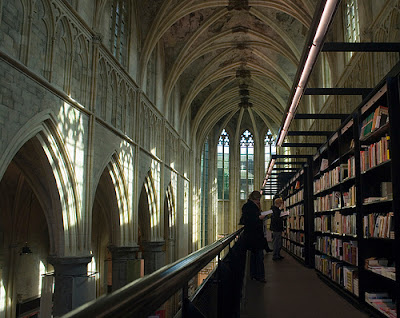
Where is `handrail`? handrail is located at coordinates (208, 257).